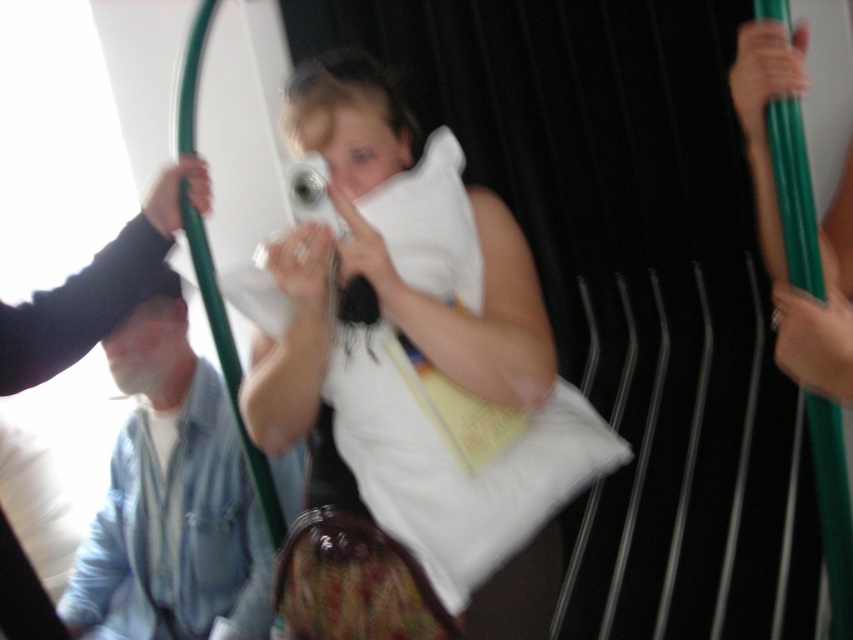
Can you confirm if denim jacket at lower left is positioned to the left of black fabric hand at upper left?

Indeed, denim jacket at lower left is positioned on the left side of black fabric hand at upper left.

Based on the photo, between denim jacket at lower left and black fabric hand at upper left, which one is positioned higher?

black fabric hand at upper left is higher up.

Where is `denim jacket at lower left`? This screenshot has width=853, height=640. denim jacket at lower left is located at coordinates (171, 497).

Is white soft pillow at center positioned behind black fabric hand at upper left?

No, it is not.

Is point (299, 273) closer to viewer compared to point (167, 192)?

Yes, it is.

This screenshot has width=853, height=640. I want to click on white soft pillow at center, so click(384, 243).

Identify the location of white soft pillow at center. (384, 243).

Between point (318, 292) and point (90, 589), which one is positioned in front?

Point (318, 292) is in front.

Locate an element on the screen. white soft pillow at center is located at coordinates [384, 243].